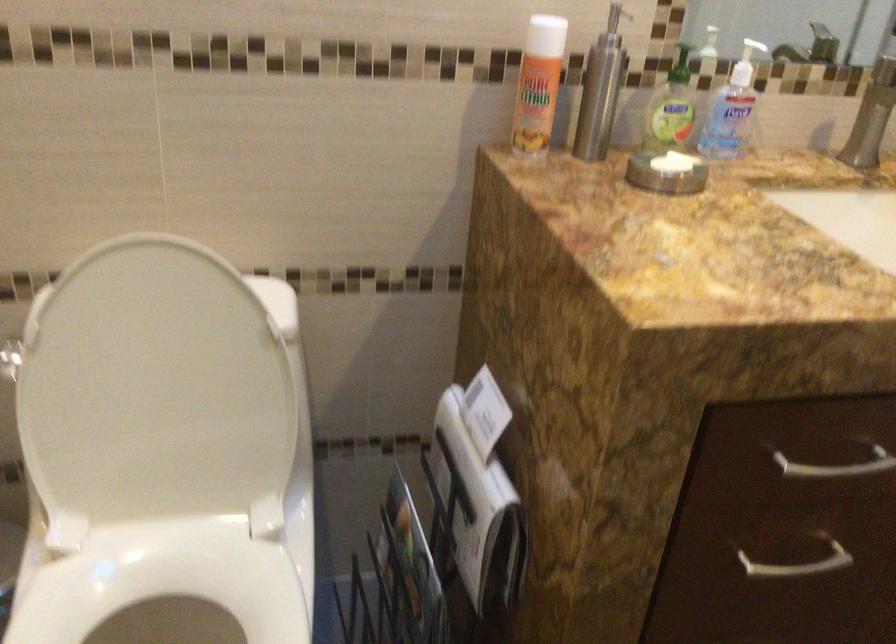
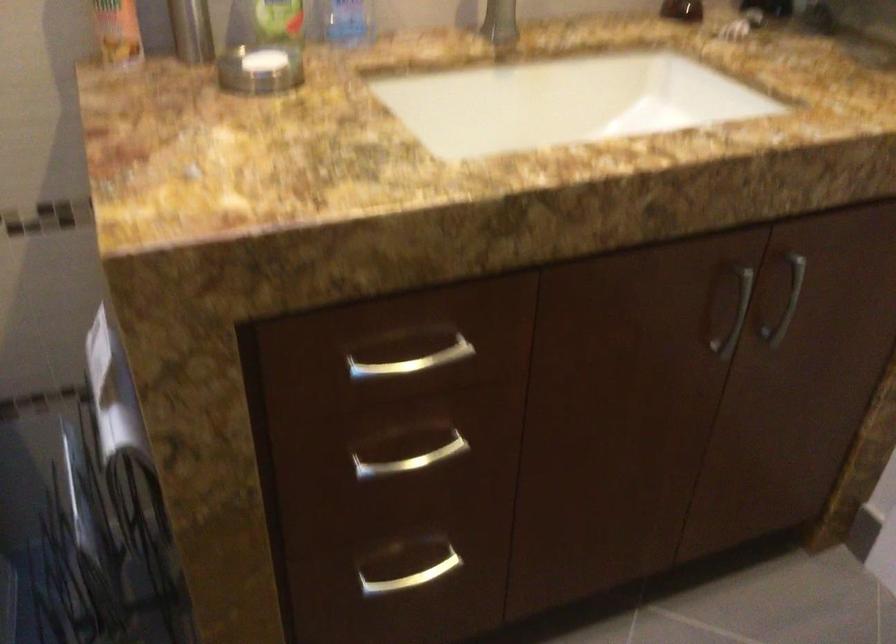
Question: Which direction would the cameraman need to move to produce the second image? Reply with the corresponding letter.

Choices:
 (A) Left
 (B) Right
 (C) Forward
 (D) Backward

Answer: (B)